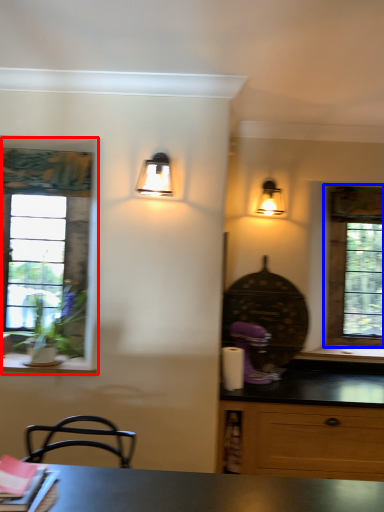
Question: Which object appears closest to the camera in this image, window (highlighted by a red box) or window (highlighted by a blue box)?

Choices:
 (A) window
 (B) window

Answer: (A)